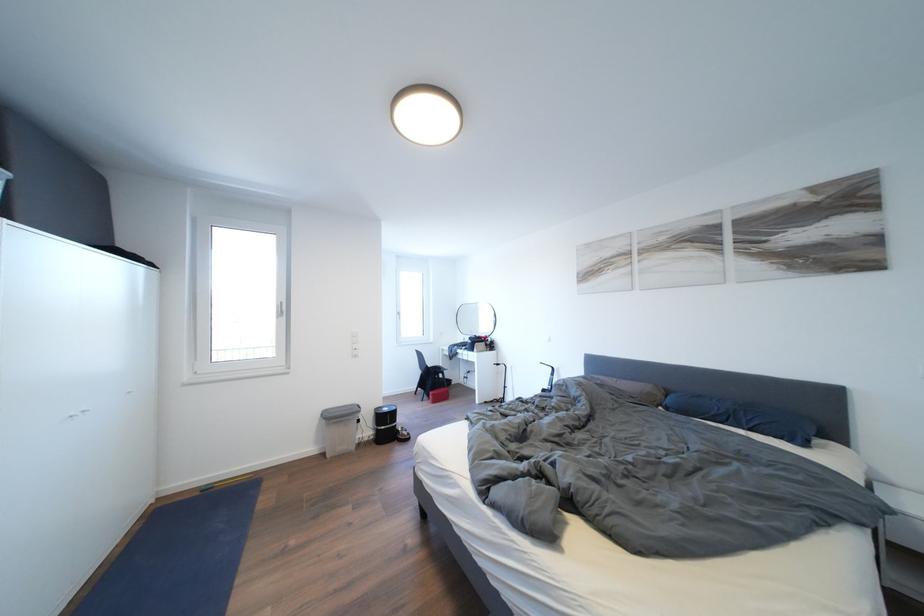
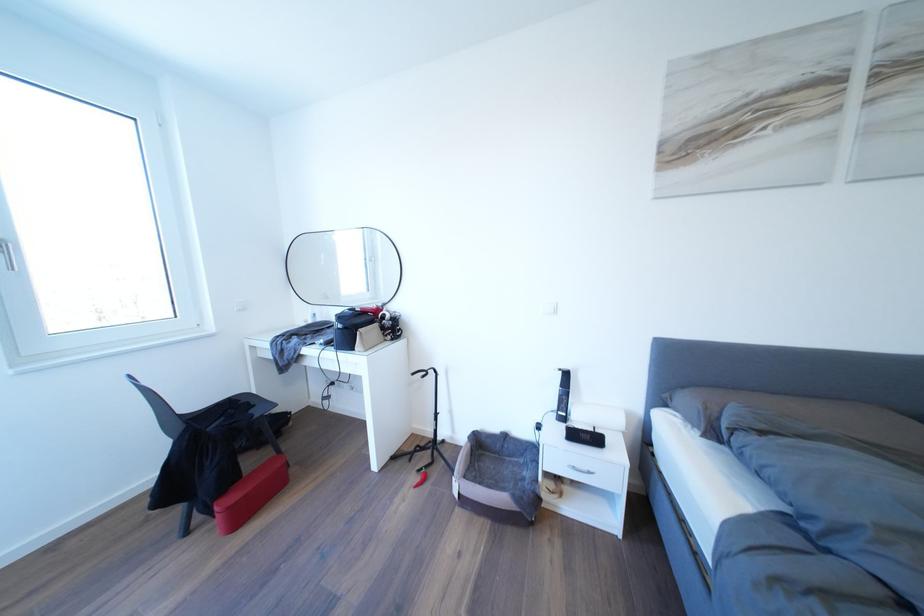
Find the pixel in the second image that matches point 436,400 in the first image.

(217, 519)